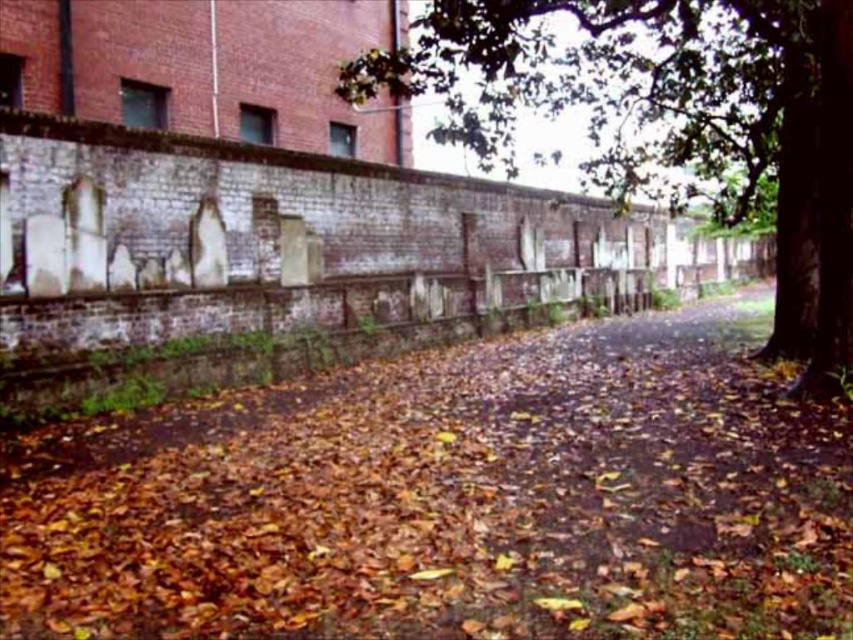
Is point (699, 392) positioned behind point (402, 58)?

No, (699, 392) is closer to viewer.

Where is `brown leafy dirt at center`? brown leafy dirt at center is located at coordinates (451, 499).